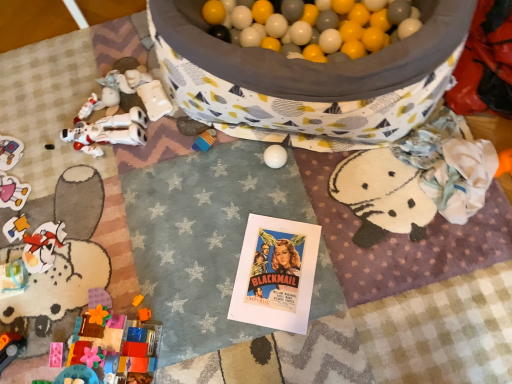
Identify the location of free space behind white matte robot at left, the fourth toy positioned from the bottom. (96, 71).